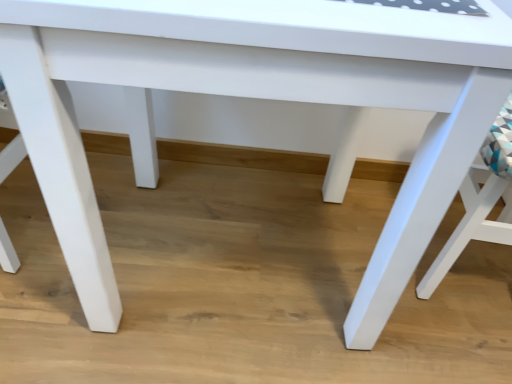
At what (x,y) coordinates should I click in order to perform the action: click on vacant area that is in front of white glossy swivel chair at lower right. Please return your answer as a coordinate pair (x, y). This screenshot has height=384, width=512. Looking at the image, I should click on (449, 345).